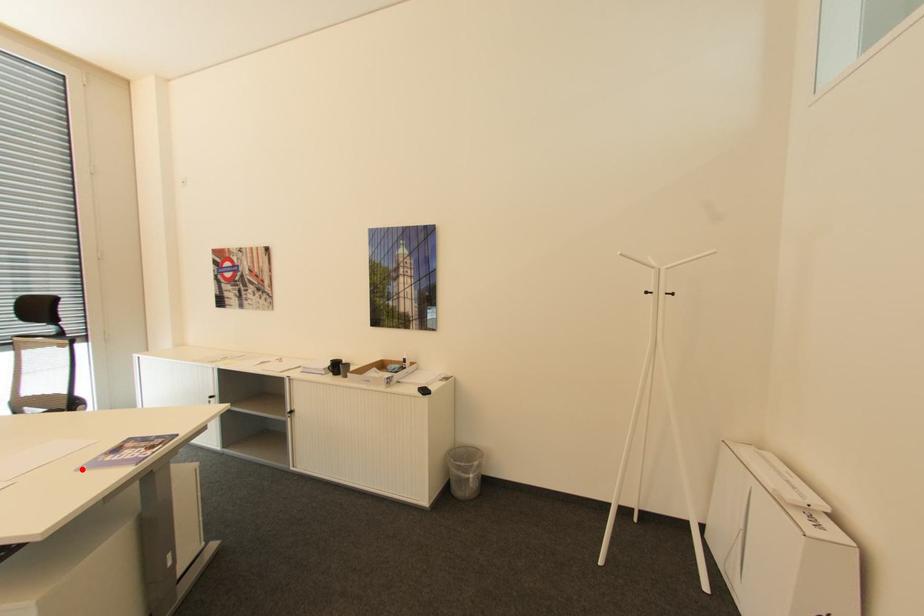
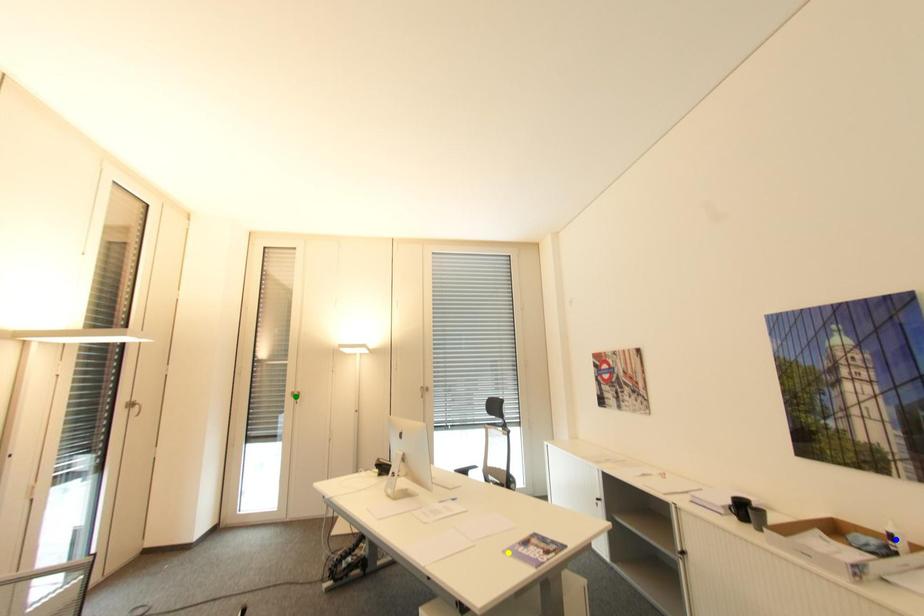
Question: I am providing you with two images of the same scene from different viewpoints. A red point is marked on the first image. You are given multiple points on the second image. Which spot in image 2 lines up with the point in image 1?

Choices:
 (A) green point
 (B) blue point
 (C) yellow point

Answer: (C)